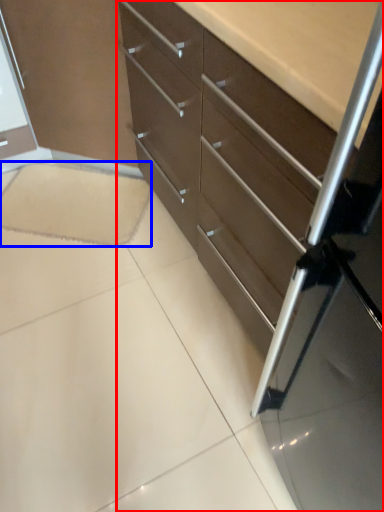
Question: Which object is closer to the camera taking this photo, chest of drawers (highlighted by a red box) or ceramic tile (highlighted by a blue box)?

Choices:
 (A) chest of drawers
 (B) ceramic tile

Answer: (A)